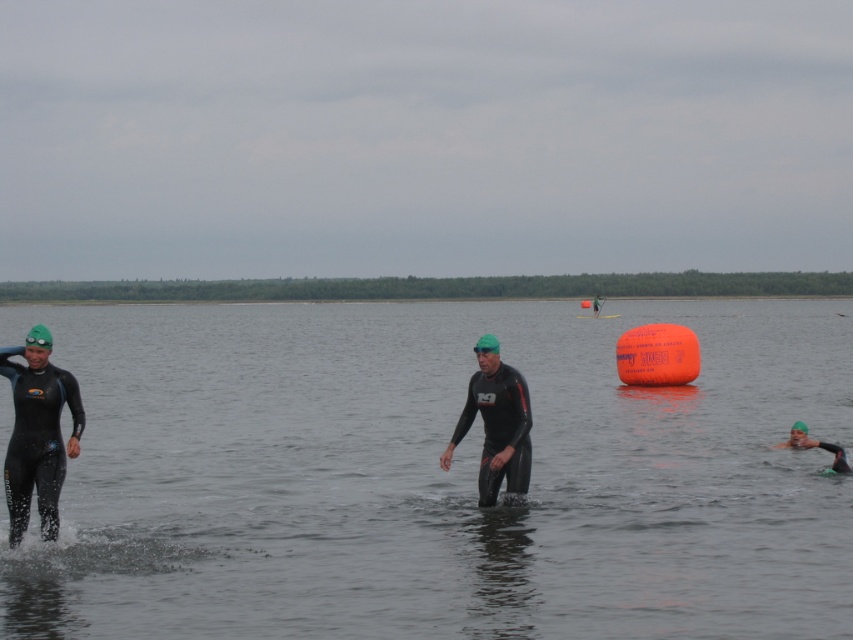
Can you confirm if transparent water at center is taller than black matte wetsuit at center?

Yes, transparent water at center is taller than black matte wetsuit at center.

Is point (215, 364) farther from camera compared to point (476, 394)?

Yes, point (215, 364) is behind point (476, 394).

Does point (280, 540) come behind point (485, 364)?

Yes, it is.

Locate an element on the screen. The height and width of the screenshot is (640, 853). transparent water at center is located at coordinates (436, 476).

The image size is (853, 640). What do you see at coordinates (436, 476) in the screenshot?
I see `transparent water at center` at bounding box center [436, 476].

Who is higher up, transparent water at center or black matte wetsuit at left?

Positioned higher is transparent water at center.

Measure the distance between point (x=137, y=616) and camera.

35.05 feet

In order to click on transparent water at center in this screenshot , I will do `click(436, 476)`.

Which is below, black matte wetsuit at left or black matte wetsuit at center?

black matte wetsuit at center is below.

Describe the element at coordinates (38, 433) in the screenshot. I see `black matte wetsuit at left` at that location.

This screenshot has width=853, height=640. Find the location of `black matte wetsuit at left`. black matte wetsuit at left is located at coordinates coord(38,433).

The width and height of the screenshot is (853, 640). I want to click on black matte wetsuit at left, so click(x=38, y=433).